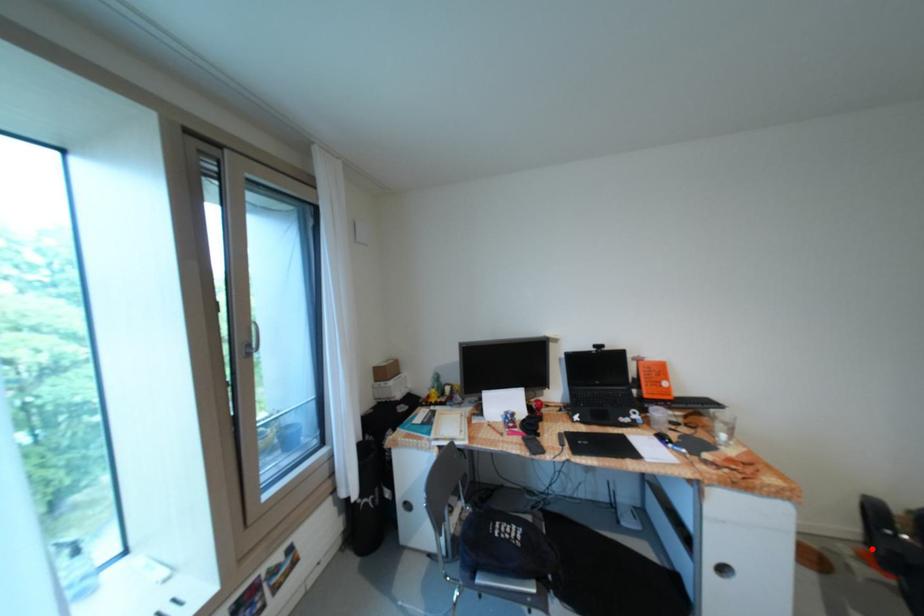
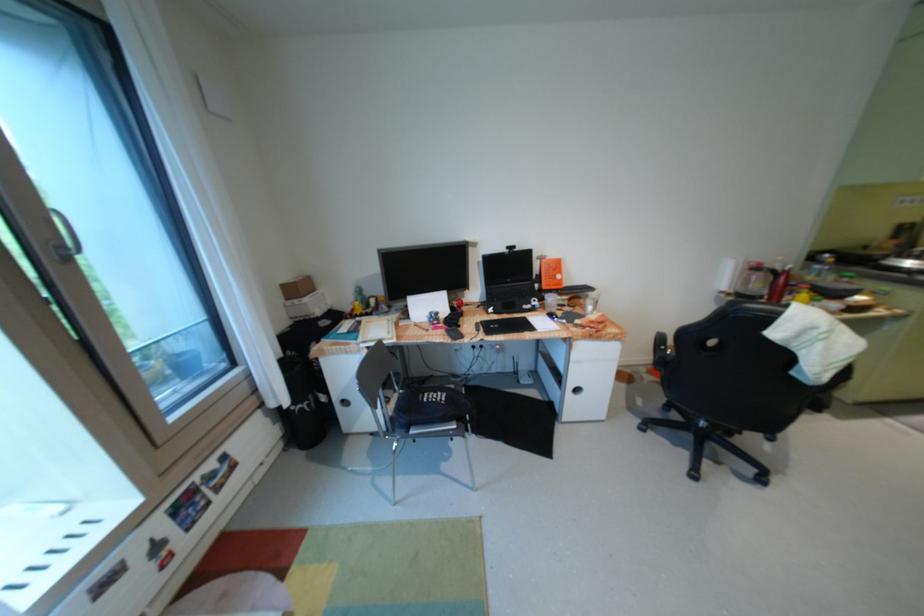
Question: I am providing you with two images of the same scene from different viewpoints. Given a red point in image1, look at the same physical point in image2. Is it:

Choices:
 (A) Closer to the viewpoint
 (B) Farther from the viewpoint

Answer: (A)